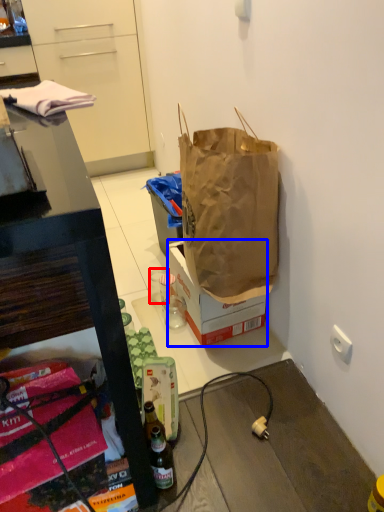
Question: Which object appears closest to the camera in this image, coffee cup (highlighted by a red box) or box (highlighted by a blue box)?

Choices:
 (A) coffee cup
 (B) box

Answer: (B)